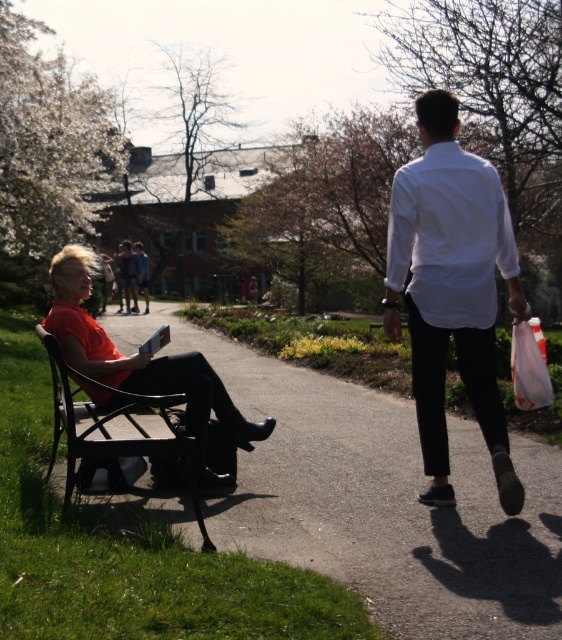
You are a park visitor who wants to sit down. You see the wooden bench at left and the black metal bench at left. Which one has more space to sit?

The wooden bench at left is larger in size than the black metal bench at left, so it has more space to sit.

You are a park visitor who wants to sit down. You see the wooden bench at left and the black metal bench at left. Which one is shorter?

The wooden bench at left is shorter than the black metal bench at left.

You are a photographer standing at the center of the pathway. You want to take a photo of both the white smooth shirt at right and the matte orange shirt at left. Which person should you focus on first to ensure both are in frame?

The white smooth shirt at right might be wider than matte orange shirt at left, so you should focus on the white smooth shirt at right first to ensure both are in frame.